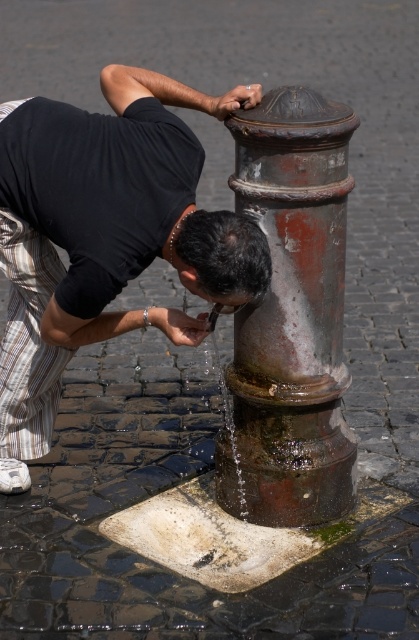
Question: Among these points, which one is farthest from the camera?

Choices:
 (A) (291, 266)
 (B) (43, 326)

Answer: (A)

Question: Can you confirm if matte black shirt at left is thinner than rusty metal hydrant at center?

Choices:
 (A) yes
 (B) no

Answer: (B)

Question: Can you confirm if matte black shirt at left is smaller than rusty metal hydrant at center?

Choices:
 (A) yes
 (B) no

Answer: (B)

Question: Is matte black shirt at left smaller than rusty metal hydrant at center?

Choices:
 (A) no
 (B) yes

Answer: (A)

Question: Which of the following is the farthest from the observer?

Choices:
 (A) rusty metal hydrant at center
 (B) matte black shirt at left

Answer: (A)